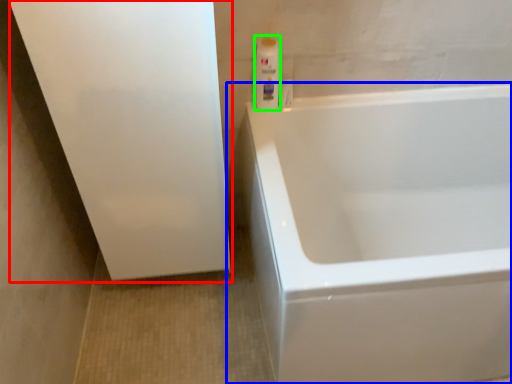
Question: Considering the real-world distances, which object is farthest from screen door (highlighted by a red box)? bathtub (highlighted by a blue box) or cleaning product (highlighted by a green box)?

Choices:
 (A) bathtub
 (B) cleaning product

Answer: (A)